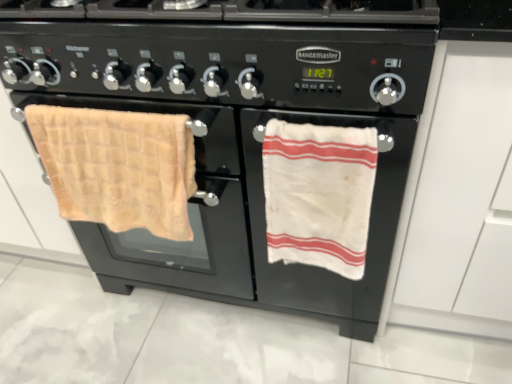
Question: Considering their positions, is white matte drawer at right located in front of or behind beige waffle weave towel at left, positioned as the 2th beach towel in right-to-left order?

Choices:
 (A) behind
 (B) front

Answer: (B)

Question: Is point (506, 46) positioned closer to the camera than point (48, 144)?

Choices:
 (A) farther
 (B) closer

Answer: (B)

Question: Which object is positioned farthest from the white cotton towel at right, which is the 1th beach towel from right to left?

Choices:
 (A) beige waffle weave towel at left, positioned as the 2th beach towel in right-to-left order
 (B) black matte gas stove at center
 (C) white matte drawer at right

Answer: (A)

Question: Estimate the real-world distances between objects in this image. Which object is closer to the white matte drawer at right?

Choices:
 (A) beige waffle weave towel at left, positioned as the 2th beach towel in right-to-left order
 (B) white cotton towel at right, which ranks as the 2th beach towel in left-to-right order
 (C) black matte gas stove at center

Answer: (B)